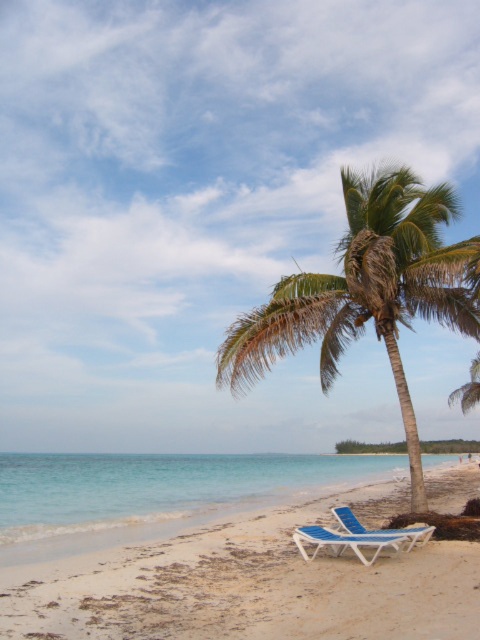
Question: Does green leafy palm tree at center have a greater width compared to clear blue water at lower left?

Choices:
 (A) yes
 (B) no

Answer: (B)

Question: Does white sandy beach at lower center appear on the left side of blue plastic beach chair at lower center?

Choices:
 (A) yes
 (B) no

Answer: (A)

Question: Which point is closer to the camera taking this photo?

Choices:
 (A) (310, 557)
 (B) (7, 512)
 (C) (344, 333)

Answer: (A)

Question: Which point is closer to the camera?

Choices:
 (A) white sandy beach at lower center
 (B) clear blue water at lower left

Answer: (A)

Question: In this image, where is green leafy palm tree at center located relative to blue plastic beach chair at lower center?

Choices:
 (A) below
 (B) above

Answer: (B)

Question: Which point is closer to the camera?

Choices:
 (A) (456, 321)
 (B) (396, 534)

Answer: (B)